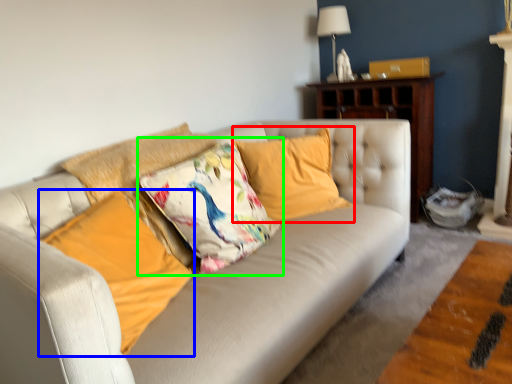
Question: Which object is the farthest from pillow (highlighted by a red box)? Choose among these: pillow (highlighted by a blue box) or pillow (highlighted by a green box).

Choices:
 (A) pillow
 (B) pillow

Answer: (A)